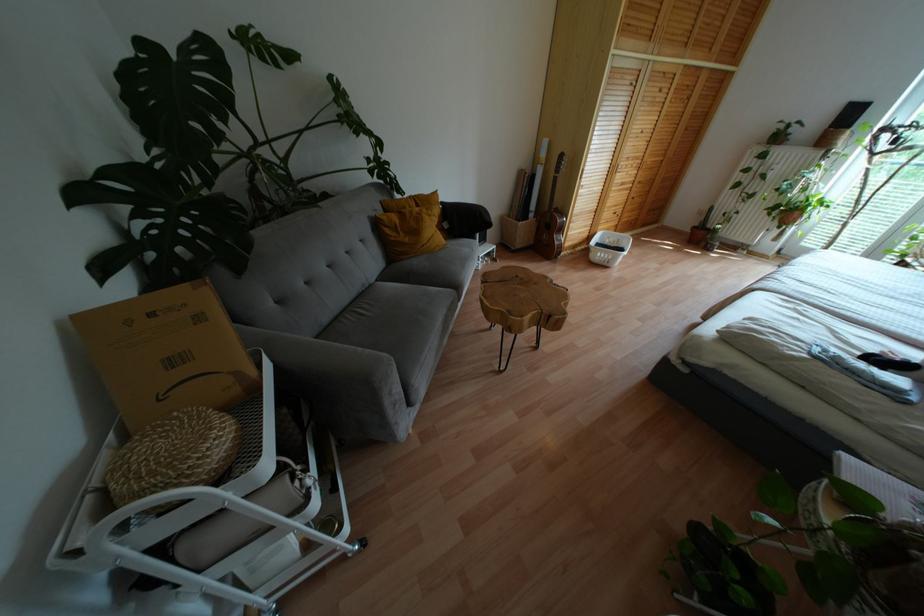
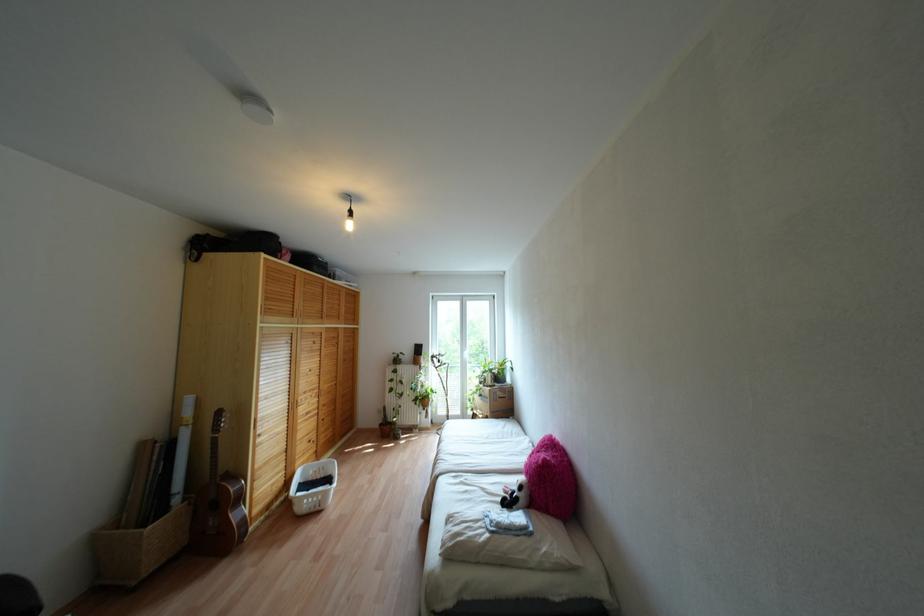
In the second image, find the point that corresponds to the point at 622,184 in the first image.

(307, 413)